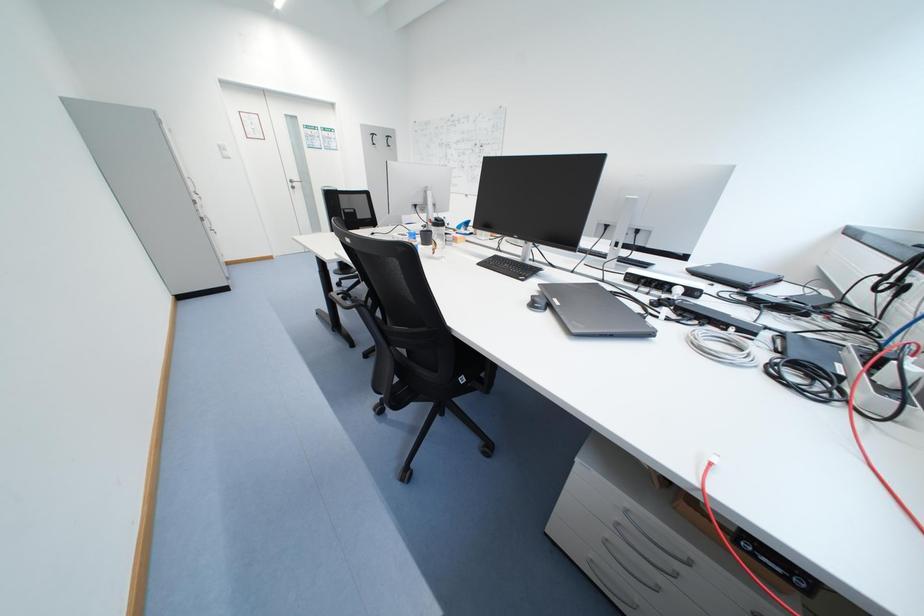
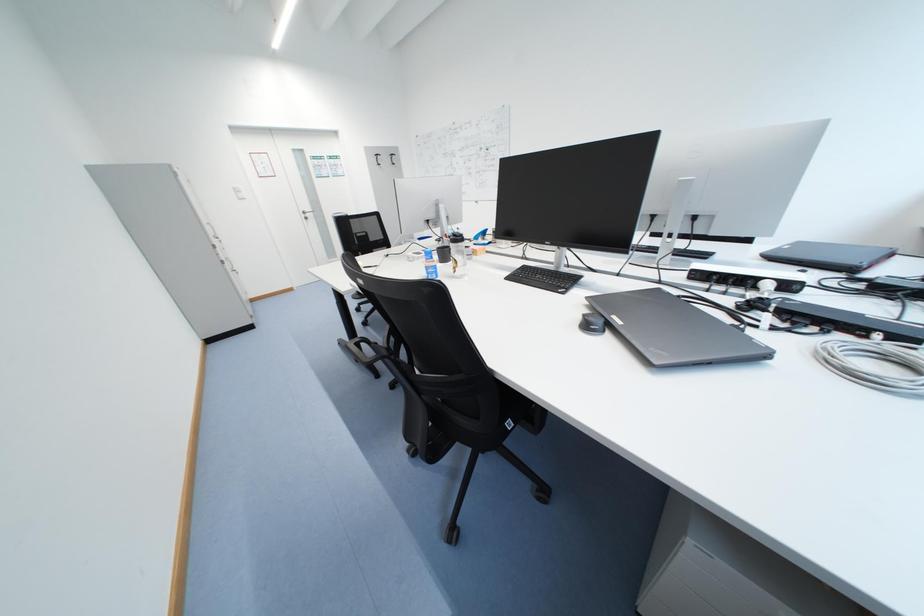
Question: The first image is from the beginning of the video and the second image is from the end. How did the camera likely rotate when shooting the video?

Choices:
 (A) Left
 (B) Right
 (C) Up
 (D) Down

Answer: (A)